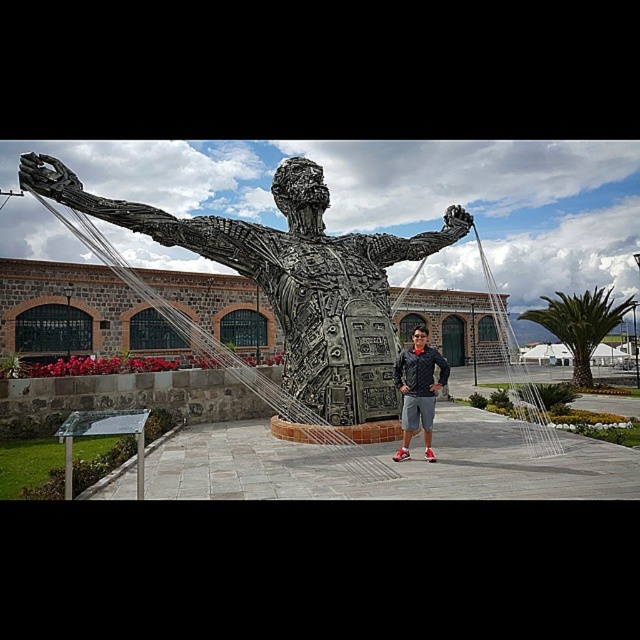
Question: Which point appears closest to the camera in this image?

Choices:
 (A) (369, 273)
 (B) (516, 380)
 (C) (433, 394)

Answer: (C)

Question: Which point is farther to the camera?

Choices:
 (A) matte black jacket at center
 (B) shiny metallic statue at center
 (C) metallic wire at center

Answer: (C)

Question: Considering the relative positions of metallic wire at center and matte black jacket at center in the image provided, where is metallic wire at center located with respect to matte black jacket at center?

Choices:
 (A) left
 (B) right

Answer: (B)

Question: Based on their relative distances, which object is nearer to the shiny metallic statue at center?

Choices:
 (A) matte black jacket at center
 (B) metallic wire at center

Answer: (A)

Question: Is the position of shiny metallic statue at center more distant than that of matte black jacket at center?

Choices:
 (A) no
 (B) yes

Answer: (B)

Question: Does shiny metallic statue at center appear on the left side of metallic wire at center?

Choices:
 (A) no
 (B) yes

Answer: (B)